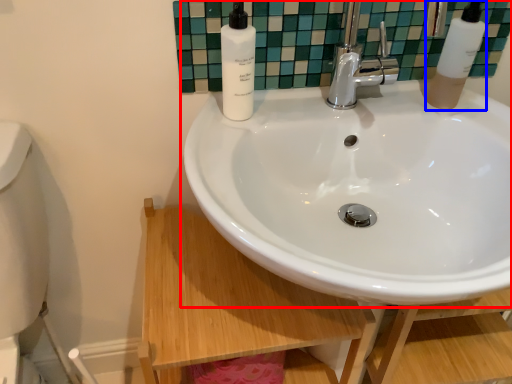
Question: Which object is closer to the camera taking this photo, sink (highlighted by a red box) or soap dispenser (highlighted by a blue box)?

Choices:
 (A) sink
 (B) soap dispenser

Answer: (A)